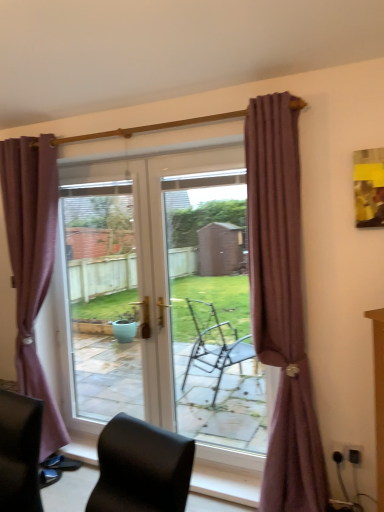
Measure the distance between point (24, 288) and camera.

The depth of point (24, 288) is 9.58 feet.

The image size is (384, 512). What are the coordinates of `mauve fabric curtain at right, which is counted as the 2th curtain, starting from the left` in the screenshot? It's located at (281, 304).

Describe the element at coordinates (19, 452) in the screenshot. I see `black leather chair at lower left` at that location.

What do you see at coordinates (214, 312) in the screenshot? I see `transparent glass door at center` at bounding box center [214, 312].

Describe the element at coordinates (103, 298) in the screenshot. I see `transparent glass door at center` at that location.

Where is `purple fabric curtain at left, which ranks as the 2th curtain in front-to-back order`? Image resolution: width=384 pixels, height=512 pixels. purple fabric curtain at left, which ranks as the 2th curtain in front-to-back order is located at coordinates (32, 261).

From a real-world perspective, which object rests below the other?

From a 3D spatial view, transparent glass door at center is below.

Between transparent glass door at center and purple fabric curtain at left, which is counted as the first curtain, starting from the left, which one has smaller size?

transparent glass door at center.

From the image's perspective, which object appears higher, transparent glass door at center or purple fabric curtain at left, which ranks as the 2th curtain in front-to-back order?

From the image's view, purple fabric curtain at left, which ranks as the 2th curtain in front-to-back order, is above.

Is transparent glass door at center further to the viewer compared to purple fabric curtain at left, which ranks as the 2th curtain in front-to-back order?

Yes, the depth of transparent glass door at center is greater than that of purple fabric curtain at left, which ranks as the 2th curtain in front-to-back order.

Between transparent glass door at center and transparent glass door at center, which one has smaller size?

transparent glass door at center is smaller.

Is transparent glass door at center not inside transparent glass door at center?

Yes, transparent glass door at center is outside of transparent glass door at center.

Could you tell me if transparent glass door at center is turned towards transparent glass door at center?

No, transparent glass door at center is not turned towards transparent glass door at center.

Where is `screen door beneath the transparent glass door at center (from a real-world perspective)`? This screenshot has height=512, width=384. screen door beneath the transparent glass door at center (from a real-world perspective) is located at coordinates (214, 312).

Between mauve fabric curtain at right, the 1th curtain viewed from the right, and purple fabric curtain at left, the 2th curtain when ordered from right to left, which one has larger size?

purple fabric curtain at left, the 2th curtain when ordered from right to left.

Consider the image. Could you tell me if mauve fabric curtain at right, which is the second curtain from back to front, is facing purple fabric curtain at left, which is counted as the first curtain, starting from the left?

No, mauve fabric curtain at right, which is the second curtain from back to front, does not turn towards purple fabric curtain at left, which is counted as the first curtain, starting from the left.

Would you say mauve fabric curtain at right, the 1th curtain viewed from the right, is a long distance from purple fabric curtain at left, which ranks as the 2th curtain in front-to-back order?

Yes.

Looking at their sizes, would you say mauve fabric curtain at right, the 1th curtain viewed from the right, is wider or thinner than purple fabric curtain at left, the 2th curtain when ordered from right to left?

Considering their sizes, mauve fabric curtain at right, the 1th curtain viewed from the right, looks slimmer than purple fabric curtain at left, the 2th curtain when ordered from right to left.

Considering the relative sizes of purple fabric curtain at left, which is counted as the first curtain, starting from the left, and mauve fabric curtain at right, which is counted as the 2th curtain, starting from the left, in the image provided, is purple fabric curtain at left, which is counted as the first curtain, starting from the left, taller than mauve fabric curtain at right, which is counted as the 2th curtain, starting from the left,?

No.

Considering the positions of points (46, 454) and (275, 127), is point (46, 454) closer to camera compared to point (275, 127)?

Yes, it is in front of point (275, 127).

Is purple fabric curtain at left, the 2th curtain when ordered from right to left, not near mauve fabric curtain at right, which is the second curtain from back to front?

Yes, purple fabric curtain at left, the 2th curtain when ordered from right to left, is far from mauve fabric curtain at right, which is the second curtain from back to front.

In the scene shown: Can you confirm if black leather chair at lower left is shorter than transparent glass door at center?

Correct, black leather chair at lower left is not as tall as transparent glass door at center.

Would you say transparent glass door at center is part of black leather chair at lower left's contents?

No, transparent glass door at center is not surrounded by black leather chair at lower left.

Does black leather chair at lower left appear on the left side of transparent glass door at center?

Indeed, black leather chair at lower left is positioned on the left side of transparent glass door at center.

Consider the image. From the image's perspective, is black leather chair at lower left on transparent glass door at center?

Incorrect, from the image's perspective, black leather chair at lower left is lower than transparent glass door at center.

Considering the sizes of objects mauve fabric curtain at right, the 1th curtain viewed from the front, and transparent glass door at center in the image provided, who is smaller, mauve fabric curtain at right, the 1th curtain viewed from the front, or transparent glass door at center?

transparent glass door at center.

Based on the photo, is mauve fabric curtain at right, the 1th curtain viewed from the front, looking in the opposite direction of transparent glass door at center?

No, mauve fabric curtain at right, the 1th curtain viewed from the front,'s orientation is not away from transparent glass door at center.

Are mauve fabric curtain at right, the 1th curtain viewed from the right, and transparent glass door at center making contact?

No, mauve fabric curtain at right, the 1th curtain viewed from the right, is not touching transparent glass door at center.

Considering the sizes of objects transparent glass door at center and purple fabric curtain at left, the 2th curtain when ordered from right to left, in the image provided, who is bigger, transparent glass door at center or purple fabric curtain at left, the 2th curtain when ordered from right to left,?

Bigger between the two is purple fabric curtain at left, the 2th curtain when ordered from right to left.

Between transparent glass door at center and purple fabric curtain at left, the 1th curtain viewed from the back, which one has less height?

Standing shorter between the two is transparent glass door at center.

How distant is transparent glass door at center from purple fabric curtain at left, the 1th curtain viewed from the back?

The distance of transparent glass door at center from purple fabric curtain at left, the 1th curtain viewed from the back, is 5.11 feet.

Considering the positions of objects transparent glass door at center and purple fabric curtain at left, the 2th curtain when ordered from right to left, in the image provided, who is in front, transparent glass door at center or purple fabric curtain at left, the 2th curtain when ordered from right to left,?

transparent glass door at center.

Identify the location of curtain that is the 2nd object above the transparent glass door at center (from a real-world perspective). (32, 261).

Locate an element on the screen. screen door lying above the transparent glass door at center (from the image's perspective) is located at coordinates click(x=214, y=312).

From the image, which object appears to be nearer to mauve fabric curtain at right, which is counted as the 2th curtain, starting from the left, black leather chair at lower left or transparent glass door at center?

black leather chair at lower left is closer to mauve fabric curtain at right, which is counted as the 2th curtain, starting from the left.

Based on the photo, looking at the image, which one is located closer to transparent glass door at center, purple fabric curtain at left, which ranks as the 2th curtain in front-to-back order, or mauve fabric curtain at right, which is counted as the 2th curtain, starting from the left?

purple fabric curtain at left, which ranks as the 2th curtain in front-to-back order, lies closer to transparent glass door at center than the other object.

Which object lies further to the anchor point mauve fabric curtain at right, which is the second curtain from back to front, black leather chair at lower left or purple fabric curtain at left, the 2th curtain when ordered from right to left?

purple fabric curtain at left, the 2th curtain when ordered from right to left, is positioned further to the anchor mauve fabric curtain at right, which is the second curtain from back to front.

Estimate the real-world distances between objects in this image. Which object is further from mauve fabric curtain at right, the 1th curtain viewed from the right, transparent glass door at center or transparent glass door at center?

transparent glass door at center lies further to mauve fabric curtain at right, the 1th curtain viewed from the right, than the other object.

From the image, which object appears to be nearer to transparent glass door at center, transparent glass door at center or mauve fabric curtain at right, which is counted as the 2th curtain, starting from the left?

transparent glass door at center.

Looking at this image, which object lies nearer to the anchor point black leather chair at lower left, mauve fabric curtain at right, the 1th curtain viewed from the right, or transparent glass door at center?

mauve fabric curtain at right, the 1th curtain viewed from the right, is closer to black leather chair at lower left.

Which object lies further to the anchor point transparent glass door at center, purple fabric curtain at left, the 2th curtain when ordered from right to left, or black leather chair at lower left?

The object further to transparent glass door at center is black leather chair at lower left.

Which object lies further to the anchor point black leather chair at lower left, transparent glass door at center or purple fabric curtain at left, which ranks as the 2th curtain in front-to-back order?

transparent glass door at center is positioned further to the anchor black leather chair at lower left.

At what (x,y) coordinates should I click in order to perform the action: click on window screen between black leather chair at lower left and transparent glass door at center in the horizontal direction. Please return your answer as a coordinate pair (x, y). Image resolution: width=384 pixels, height=512 pixels. Looking at the image, I should click on (103, 298).

I want to click on window screen located between purple fabric curtain at left, which is counted as the first curtain, starting from the left, and transparent glass door at center in the left-right direction, so click(103, 298).

Where is `curtain situated between black leather chair at lower left and transparent glass door at center from left to right`? This screenshot has width=384, height=512. curtain situated between black leather chair at lower left and transparent glass door at center from left to right is located at coordinates (32, 261).

The height and width of the screenshot is (512, 384). Identify the location of window screen situated between black leather chair at lower left and mauve fabric curtain at right, the 1th curtain viewed from the front, from left to right. (103, 298).